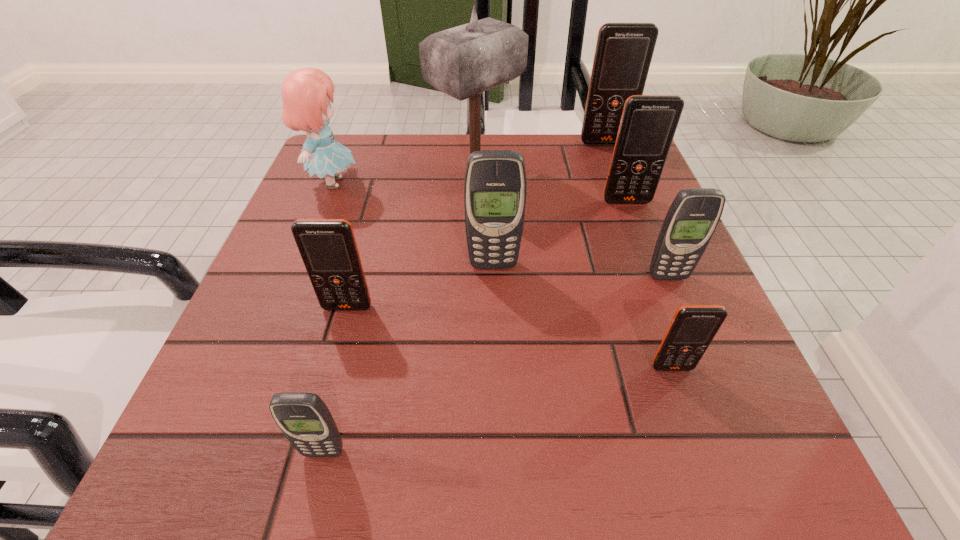
At what (x,y) coordinates should I click in order to perform the action: click on vacant space located on the screen of the second biggest orange cellular telephone. Please return your answer as a coordinate pair (x, y). Image resolution: width=960 pixels, height=540 pixels. Looking at the image, I should click on (666, 305).

This screenshot has height=540, width=960. What are the coordinates of `vacant space located 0.330m on the screen of the biggest gray cellular telephone` in the screenshot? It's located at (499, 456).

Locate an element on the screen. blank space located 0.200m on the screen of the fourth nearest object is located at coordinates (711, 383).

Identify the location of vacant space situated 0.140m on the screen of the third nearest object. This screenshot has width=960, height=540. (325, 389).

Where is `vacant region located on the screen of the nearest orange cellular telephone`? The height and width of the screenshot is (540, 960). vacant region located on the screen of the nearest orange cellular telephone is located at coordinates (714, 489).

Find the location of a particular element. The image size is (960, 540). mallet that is at the far edge is located at coordinates (464, 61).

At what (x,y) coordinates should I click in order to perform the action: click on cellular telephone located at the far edge. Please return your answer as a coordinate pair (x, y). Looking at the image, I should click on (623, 54).

Find the location of `doll present at the far edge`. doll present at the far edge is located at coordinates (306, 93).

The image size is (960, 540). I want to click on object located at the near edge, so coord(305,420).

You are a GUI agent. You are given a task and a screenshot of the screen. Output one action in this format:
    pyautogui.click(x=<x>, y=<y>)
    Task: Click on the doll present at the left edge
    The image size is (960, 540).
    Given the screenshot: What is the action you would take?
    pyautogui.click(x=306, y=93)